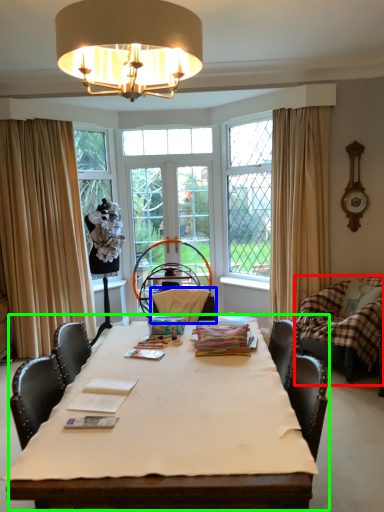
Question: Which object is positioned closest to swivel chair (highlighted by a red box)? Select from armchair (highlighted by a blue box) and table (highlighted by a green box).

Choices:
 (A) armchair
 (B) table

Answer: (A)